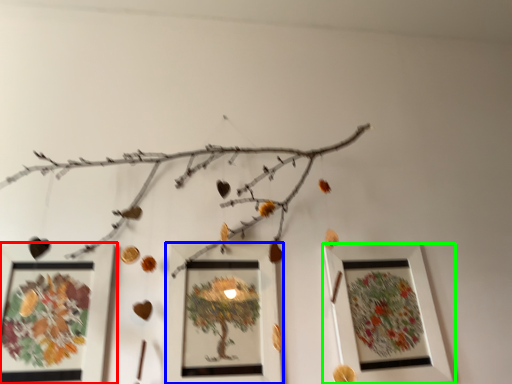
Question: Considering the real-world distances, which object is farthest from picture frame (highlighted by a red box)? picture frame (highlighted by a blue box) or picture frame (highlighted by a green box)?

Choices:
 (A) picture frame
 (B) picture frame

Answer: (B)